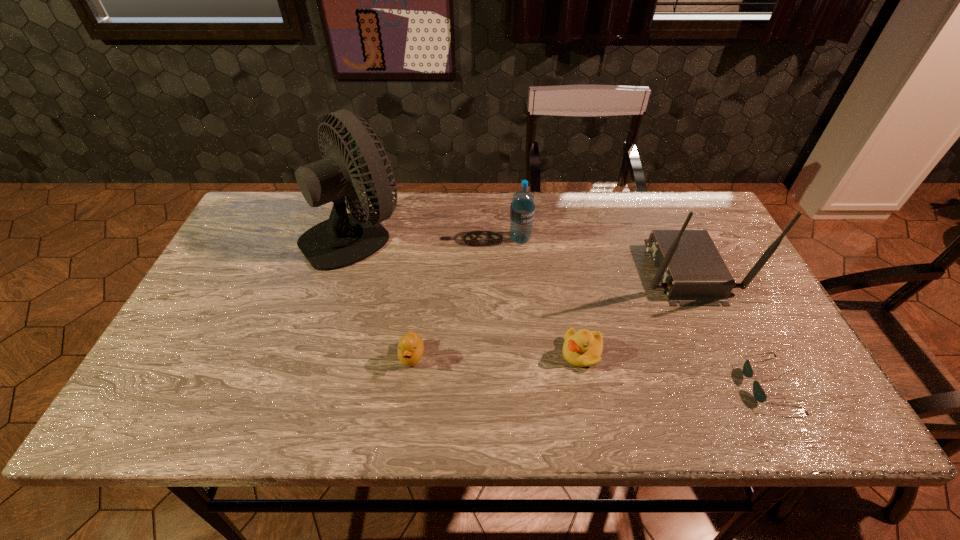
Identify the location of vacant area that lies between the leftmost object and the left duckling. [x=384, y=295].

Image resolution: width=960 pixels, height=540 pixels. Find the location of `free space between the fifth object from right to left and the fourth shortest object`. free space between the fifth object from right to left and the fourth shortest object is located at coordinates (466, 298).

You are a GUI agent. You are given a task and a screenshot of the screen. Output one action in this format:
    pyautogui.click(x=<x>, y=<y>)
    Task: Click on the vacant space that is in between the tallest object and the fifth shortest object
    The image size is (960, 540).
    Given the screenshot: What is the action you would take?
    pyautogui.click(x=519, y=252)

Select which object appears as the closest to the fourth object from right to left. Please provide its 2D coordinates. Your answer should be formatted as a tuple, i.e. [(x, y)], where the tuple contains the x and y coordinates of a point satisfying the conditions above.

[(693, 273)]

Image resolution: width=960 pixels, height=540 pixels. I want to click on object that can be found as the second closest to the sunglasses, so click(582, 348).

The width and height of the screenshot is (960, 540). I want to click on free region that satisfies the following two spatial constraints: 1. in front of the leftmost object to direct airflow; 2. on the left side of the third tallest object, so [353, 239].

This screenshot has width=960, height=540. In order to click on vacant region that satisfies the following two spatial constraints: 1. in front of the tallest object to direct airflow; 2. on the right side of the water bottle in this screenshot , I will do `click(353, 239)`.